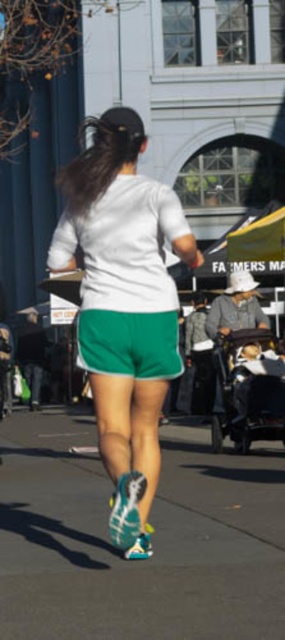
Is gray asphalt at lower center in front of white matte shorts at center?

That is True.

Who is positioned more to the left, gray asphalt at lower center or white matte shorts at center?

white matte shorts at center is more to the left.

I want to click on gray asphalt at lower center, so click(x=153, y=540).